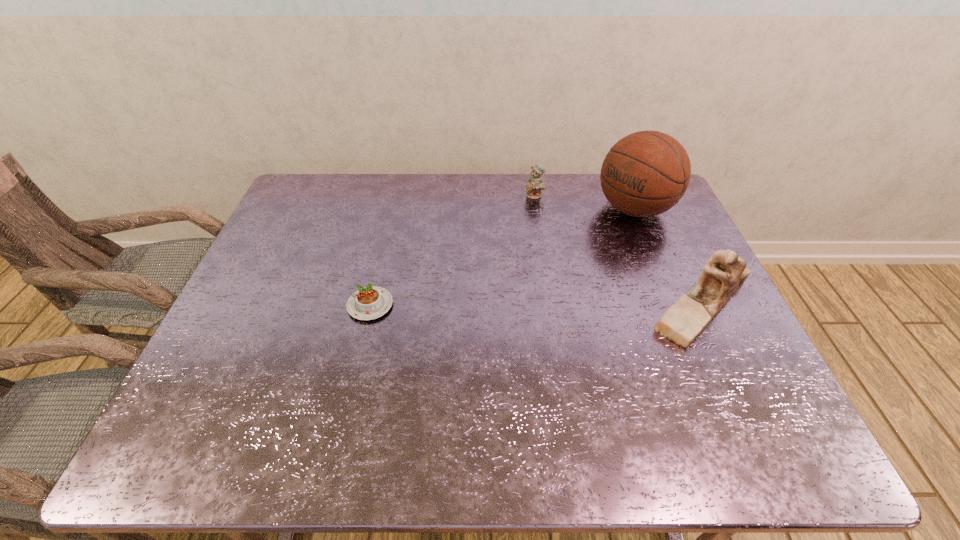
Locate an element on the screen. Image resolution: width=960 pixels, height=540 pixels. empty location between the second shortest object and the second tallest object is located at coordinates (618, 251).

Locate an element on the screen. This screenshot has width=960, height=540. free space that is in between the pudding and the figurine is located at coordinates (536, 305).

This screenshot has width=960, height=540. I want to click on free space between the basketball and the third object from right to left, so click(585, 202).

Locate an element on the screen. The image size is (960, 540). free space between the third tallest object and the leftmost object is located at coordinates (452, 251).

Locate an element on the screen. vacant point located between the basketball and the second tallest object is located at coordinates (668, 257).

Image resolution: width=960 pixels, height=540 pixels. I want to click on empty space between the third tallest object and the tallest object, so click(585, 202).

In order to click on object that is the closest to the second object from left to right in this screenshot , I will do `click(646, 173)`.

Where is `object that is the third closest to the shortest object`? object that is the third closest to the shortest object is located at coordinates (725, 272).

You are a GUI agent. You are given a task and a screenshot of the screen. Output one action in this format:
    pyautogui.click(x=<x>, y=<y>)
    Task: Click on the free location that satisfies the following two spatial constraints: 1. on the front side of the third shortest object; 2. on the front-facing side of the leftmost object
    This screenshot has width=960, height=540.
    Given the screenshot: What is the action you would take?
    pyautogui.click(x=371, y=305)

The height and width of the screenshot is (540, 960). Identify the location of vacant region that satisfies the following two spatial constraints: 1. on the front side of the second tallest object; 2. on the front-facing side of the leftmost object. (371, 305).